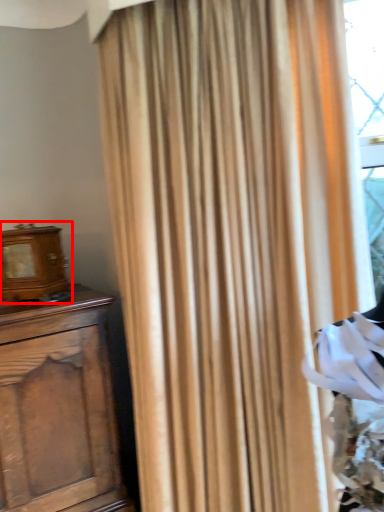
Question: From the image, what is the correct spatial relationship of alarm clock (annotated by the red box) in relation to curtain?

Choices:
 (A) right
 (B) left

Answer: (B)